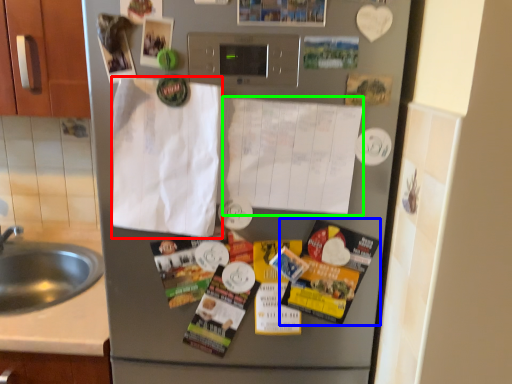
Question: Estimate the real-world distances between objects in this image. Which object is closer to envelope (highlighted by a red box), flyer (highlighted by a blue box) or paper (highlighted by a green box)?

Choices:
 (A) flyer
 (B) paper

Answer: (B)